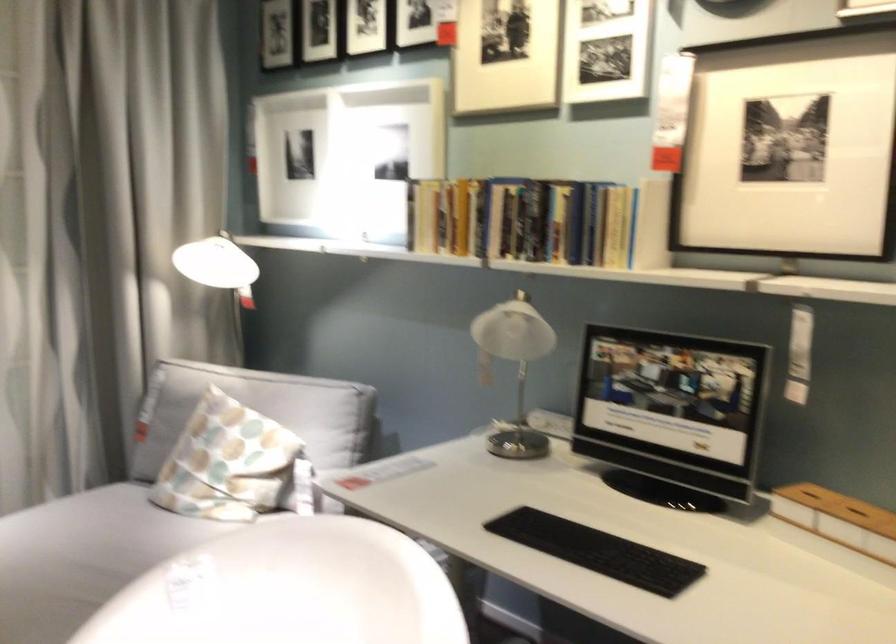
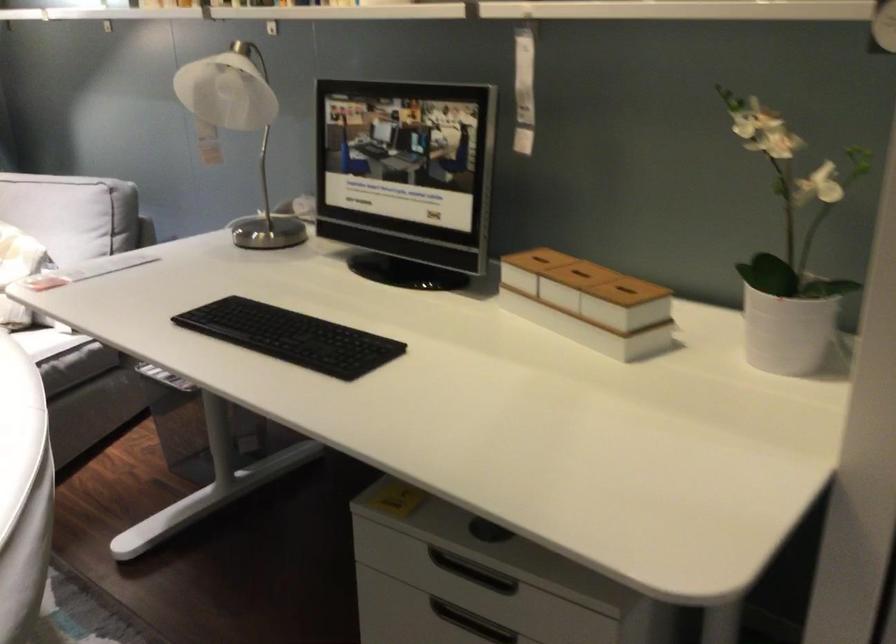
Locate, in the second image, the point that corresponds to [806,494] in the first image.

(537, 259)